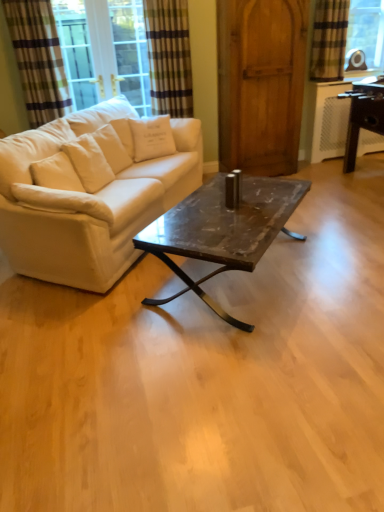
Question: In the image, is marble/black metal coffee table at center on the left side or the right side of white cotton pillow at upper left, positioned as the second pillow in bottom-to-top order?

Choices:
 (A) right
 (B) left

Answer: (A)

Question: From a real-world perspective, relative to white cotton pillow at upper left, positioned as the 1th pillow in right-to-left order, is marble/black metal coffee table at center vertically above or below?

Choices:
 (A) below
 (B) above

Answer: (A)

Question: Estimate the real-world distances between objects in this image. Which object is closer to the green striped curtain at upper left, which appears as the 2th curtain when viewed from the right?

Choices:
 (A) wooden barn door at center
 (B) plaid fabric curtain at upper right, which is the 1th curtain from right to left
 (C) white fabric pillow at left, the 2th pillow viewed from the back
 (D) marble/black metal coffee table at center
 (E) striped fabric curtain at upper left, which appears as the 3th curtain when viewed from the right

Answer: (A)

Question: Estimate the real-world distances between objects in this image. Which object is closer to the white fabric couch at left?

Choices:
 (A) plaid fabric curtain at upper right, which is the 1th curtain from right to left
 (B) striped fabric curtain at upper left, which appears as the 3th curtain when viewed from the right
 (C) white fabric pillow at left, which ranks as the second pillow in right-to-left order
 (D) green striped curtain at upper left, the second curtain from the left
 (E) white cotton pillow at upper left, which is counted as the first pillow, starting from the top

Answer: (C)